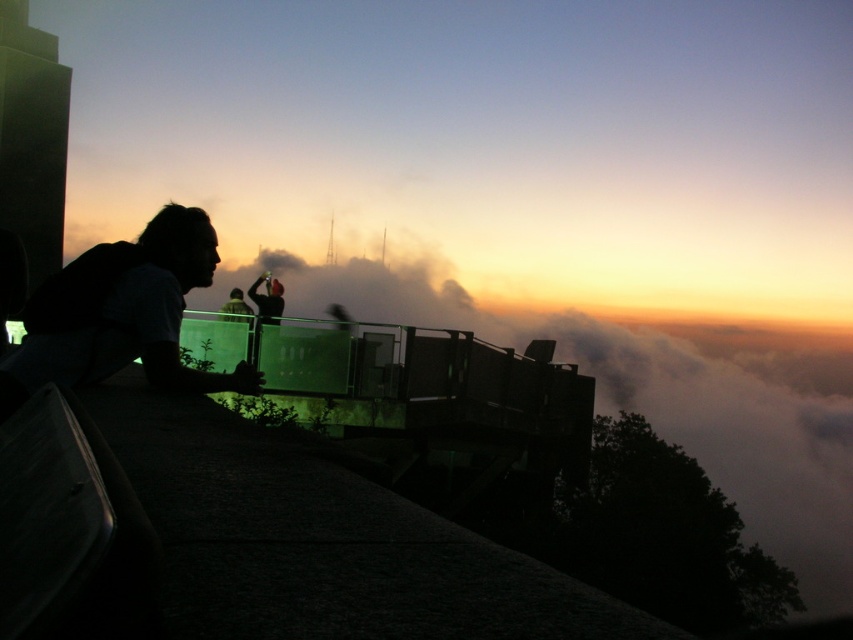
Who is positioned more to the right, dark hair at left or dark fabric jacket at center?

Positioned to the right is dark hair at left.

Is dark hair at left below dark fabric jacket at center?

Indeed, dark hair at left is positioned under dark fabric jacket at center.

Describe the element at coordinates (122, 314) in the screenshot. I see `dark hair at left` at that location.

Find the location of a particular element. dark hair at left is located at coordinates (122, 314).